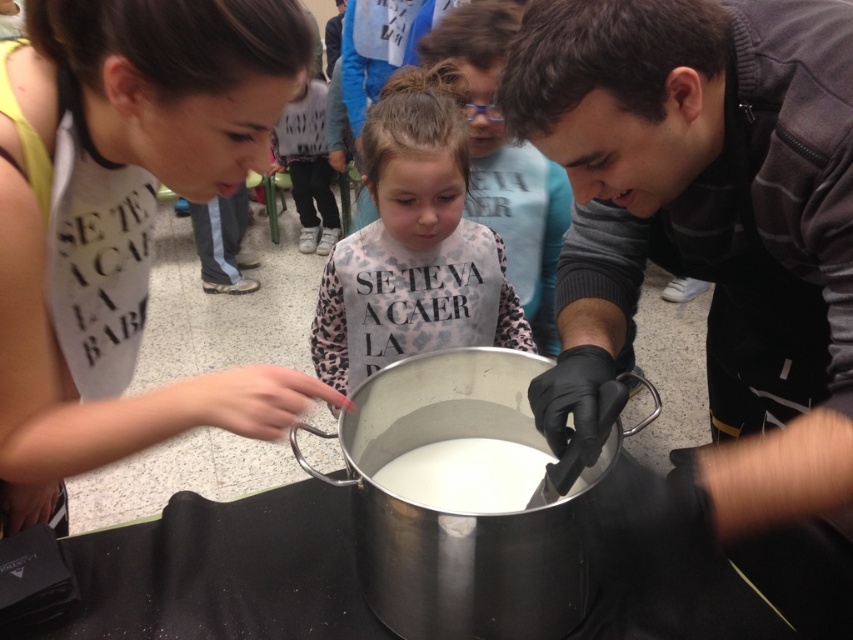
Question: Which point is closer to the camera?

Choices:
 (A) metallic silver pot at center
 (B) leopard print sweater at center

Answer: (A)

Question: Does matte white shirt at center have a larger size compared to leopard print sweater at center?

Choices:
 (A) yes
 (B) no

Answer: (B)

Question: Which point is closer to the camera?

Choices:
 (A) matte white shirt at center
 (B) white glossy liquid at center

Answer: (A)

Question: Can you confirm if leopard print sweater at center is positioned to the right of white leopard print sweater at center?

Choices:
 (A) no
 (B) yes

Answer: (A)

Question: Based on their relative distances, which object is farther from the matte white shirt at center?

Choices:
 (A) white leopard print sweater at center
 (B) leopard print sweater at center
 (C) metallic silver pot at center

Answer: (A)

Question: Does leopard print sweater at center appear under white glossy liquid at center?

Choices:
 (A) yes
 (B) no

Answer: (B)